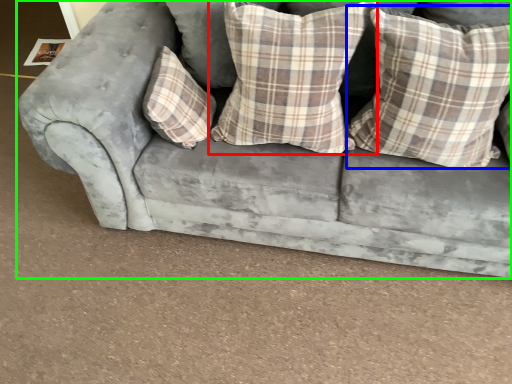
Question: Which is nearer to the pillow (highlighted by a red box)? pillow (highlighted by a blue box) or studio couch (highlighted by a green box).

Choices:
 (A) pillow
 (B) studio couch

Answer: (A)